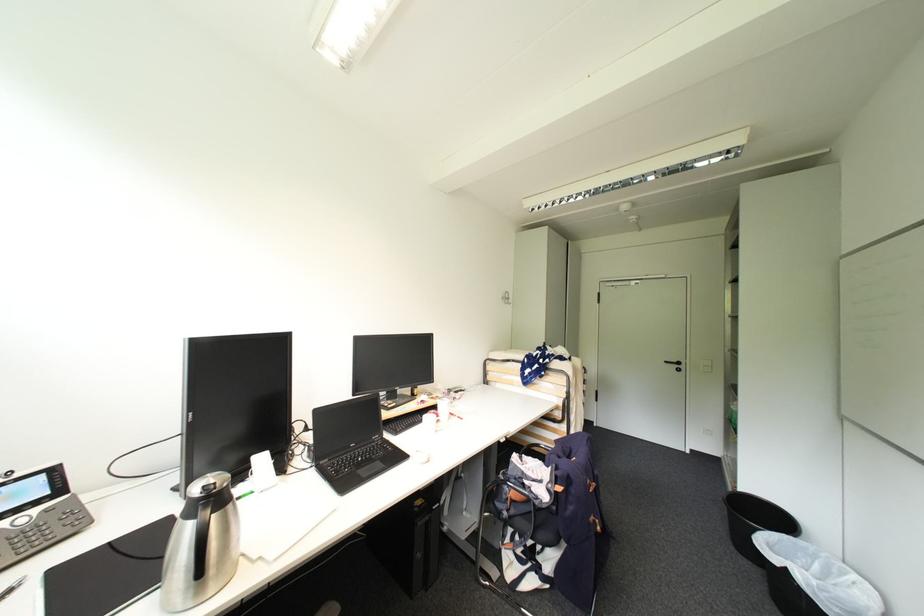
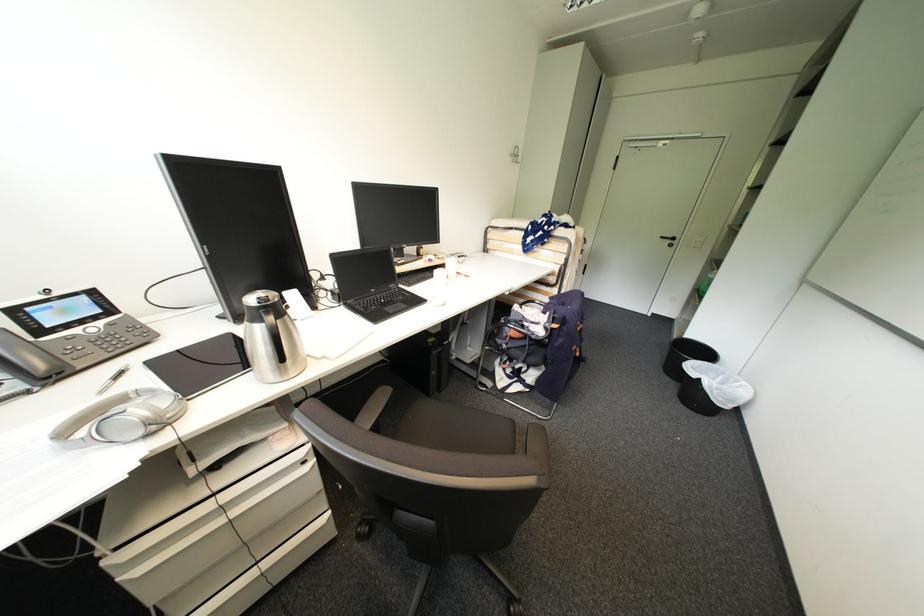
Question: Which direction would the cameraman need to move to produce the second image? Reply with the corresponding letter.

Choices:
 (A) Left
 (B) Right
 (C) Forward
 (D) Backward

Answer: (A)